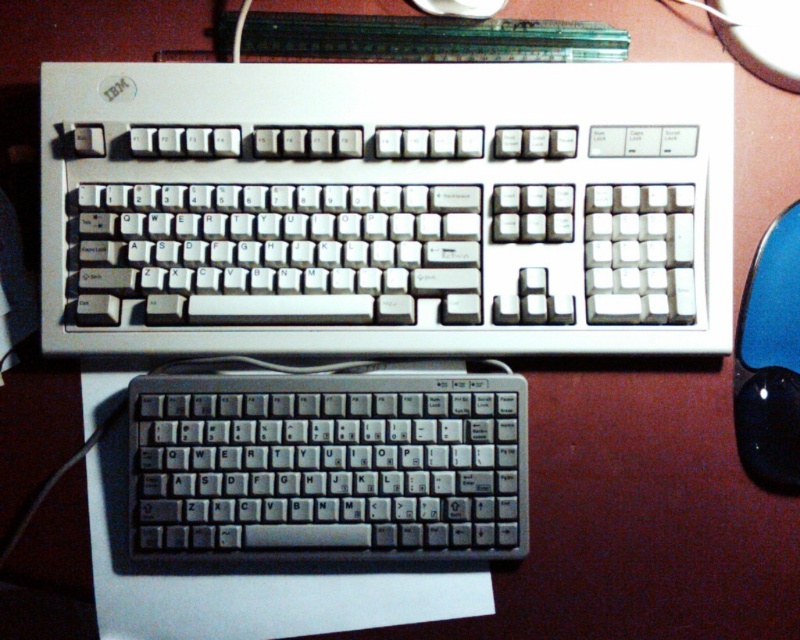
You are taking a photo of the two keyboards on the desk. You want to focus on the point closer to the camera between the two points labeled point (340, 493) and point (788, 477). Which point should you focus on?

You should focus on point (340, 493) because it is closer to the camera than point (788, 477).

You are setting up a new workspace and need to place a mouse. The mouse requires a flat area between the two keyboards. Given that the point at coordinates (x=386, y=209) is the center of the white plastic keyboard, can you determine if there is enough space between the two keyboards to place the mouse?

The point at coordinates (x=386, y=209) marks the center of the white plastic keyboard at center. Since the mouse requires a flat area between the two keyboards, but the exact distance between them isn not provided, it is unclear if there is sufficient space. However, the white plastic keyboard is at center, so there might be space between it and the other keyboard.